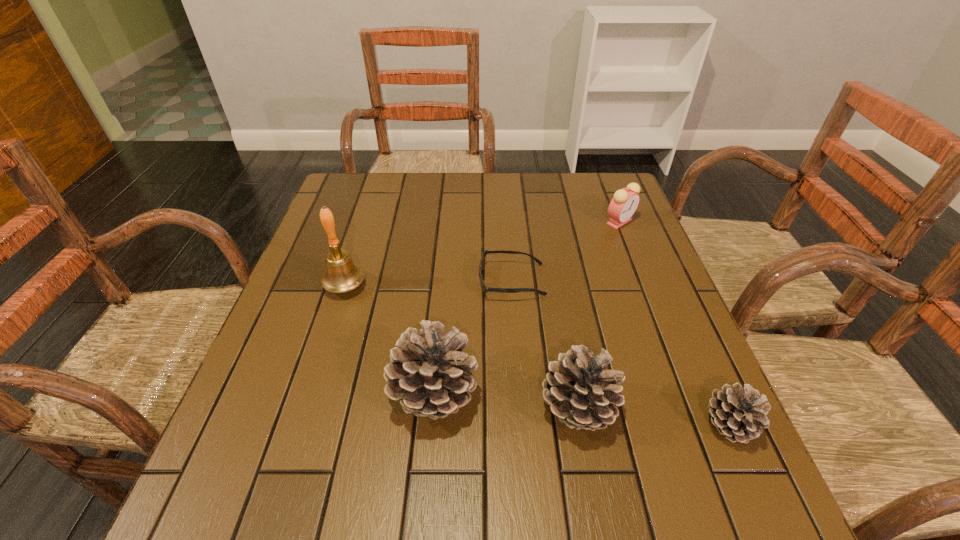
The width and height of the screenshot is (960, 540). Identify the location of object located at the far right corner. (623, 205).

The height and width of the screenshot is (540, 960). I want to click on object that is at the near right corner, so click(739, 414).

In the image, there is a desktop. Where is `vacant region at the far edge`? The image size is (960, 540). vacant region at the far edge is located at coordinates (434, 197).

This screenshot has width=960, height=540. In the image, there is a desktop. In order to click on blank space at the near edge in this screenshot , I will do `click(340, 424)`.

You are a GUI agent. You are given a task and a screenshot of the screen. Output one action in this format:
    pyautogui.click(x=<x>, y=<y>)
    Task: Click on the vacant space at the left edge of the desktop
    This screenshot has height=540, width=960.
    Given the screenshot: What is the action you would take?
    pyautogui.click(x=360, y=245)

You are a GUI agent. You are given a task and a screenshot of the screen. Output one action in this format:
    pyautogui.click(x=<x>, y=<y>)
    Task: Click on the vacant space at the right edge
    This screenshot has height=540, width=960.
    Given the screenshot: What is the action you would take?
    pyautogui.click(x=670, y=360)

Locate an element on the screen. This screenshot has width=960, height=540. vacant area at the far left corner is located at coordinates (369, 212).

In the image, there is a desktop. At what (x,y) coordinates should I click in order to perform the action: click on free space at the near right corner. Please return your answer as a coordinate pair (x, y). The width and height of the screenshot is (960, 540). Looking at the image, I should click on (715, 440).

At what (x,y) coordinates should I click in order to perform the action: click on vacant area that lies between the second tallest pinecone and the alarm clock. Please return your answer as a coordinate pair (x, y). The width and height of the screenshot is (960, 540). Looking at the image, I should click on (598, 315).

Where is `free area in between the second pinecone from left to right and the farthest object`? Image resolution: width=960 pixels, height=540 pixels. free area in between the second pinecone from left to right and the farthest object is located at coordinates (598, 315).